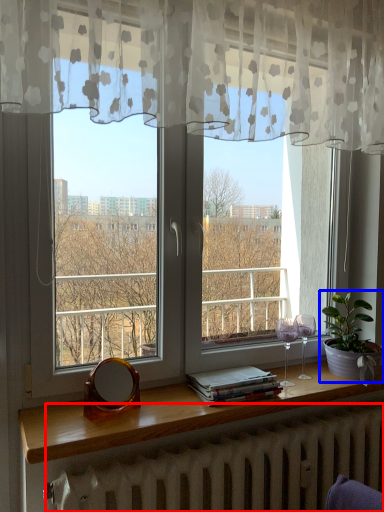
Question: Which object is closer to the camera taking this photo, radiator (highlighted by a red box) or houseplant (highlighted by a blue box)?

Choices:
 (A) radiator
 (B) houseplant

Answer: (A)